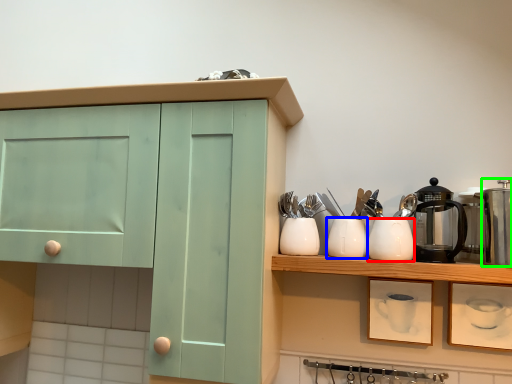
Question: Which object is positioned closest to appliance (highlighted by a red box)? Select from tableware (highlighted by a blue box) and appliance (highlighted by a green box).

Choices:
 (A) tableware
 (B) appliance

Answer: (A)